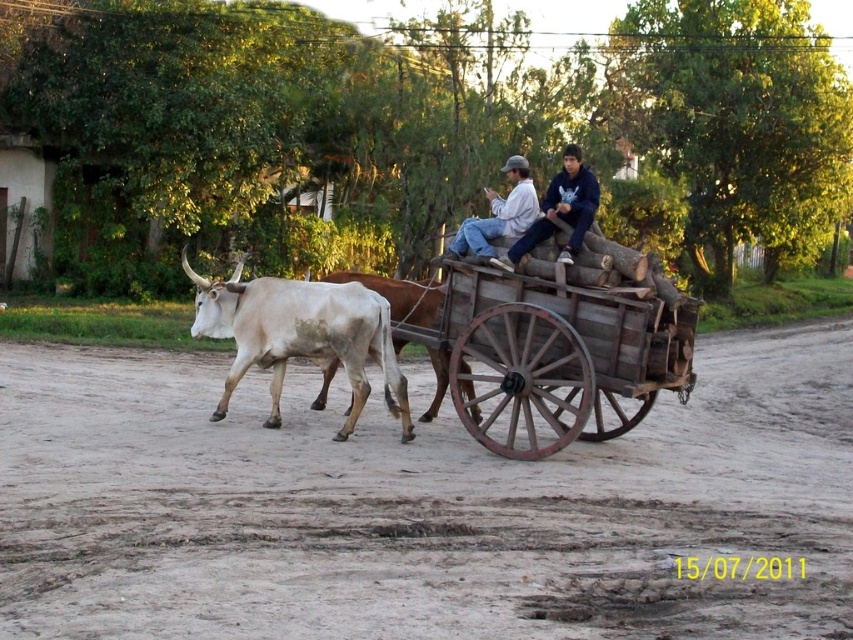
Question: Observing the image, what is the correct spatial positioning of brown dirt field at center in reference to white leather jacket at upper center?

Choices:
 (A) left
 (B) right

Answer: (A)

Question: Where is white smooth bull at center located in relation to white leather jacket at center in the image?

Choices:
 (A) left
 (B) right

Answer: (A)

Question: Which of these objects is positioned closest to the brown dirt field at center?

Choices:
 (A) white smooth bull at center
 (B) white leather jacket at upper center
 (C) white leather jacket at center

Answer: (A)

Question: Does brown dirt field at center have a larger size compared to white leather jacket at upper center?

Choices:
 (A) no
 (B) yes

Answer: (B)

Question: Which point is closer to the camera?

Choices:
 (A) white leather jacket at center
 (B) brown dirt field at center
 (C) white leather jacket at upper center

Answer: (B)

Question: Considering the real-world distances, which object is farthest from the white smooth bull at center?

Choices:
 (A) white leather jacket at upper center
 (B) brown dirt field at center
 (C) white leather jacket at center

Answer: (C)